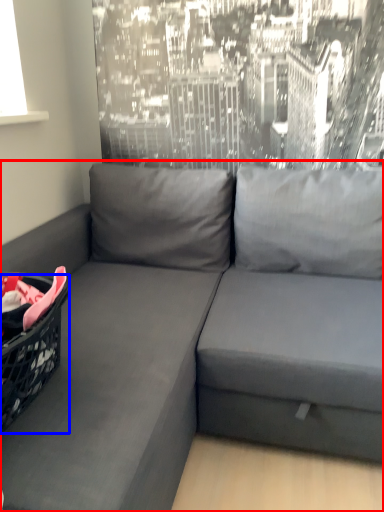
Question: Which point is further to the camera, studio couch (highlighted by a red box) or basket (highlighted by a blue box)?

Choices:
 (A) studio couch
 (B) basket

Answer: (B)